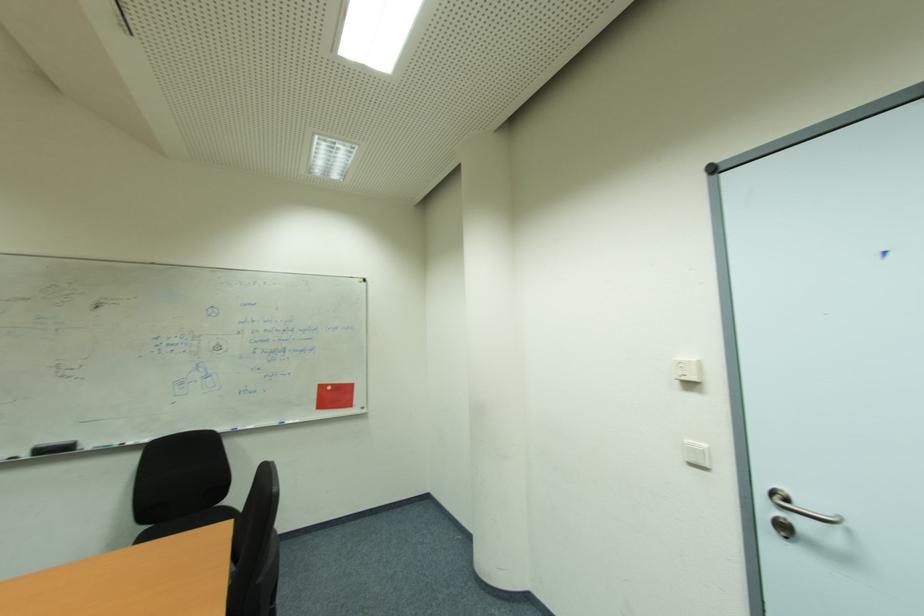
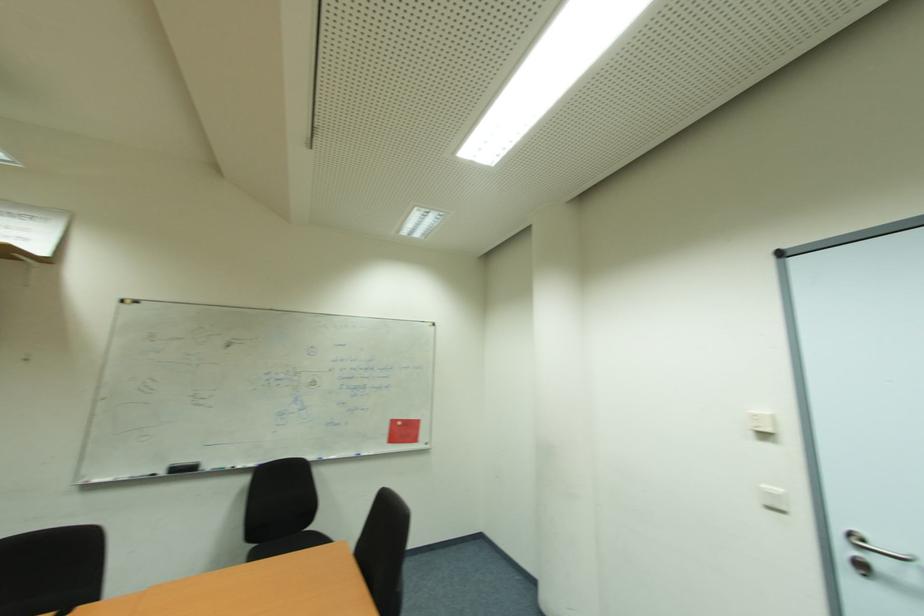
Where in the second image is the point corresponding to point (786, 529) from the first image?

(869, 570)